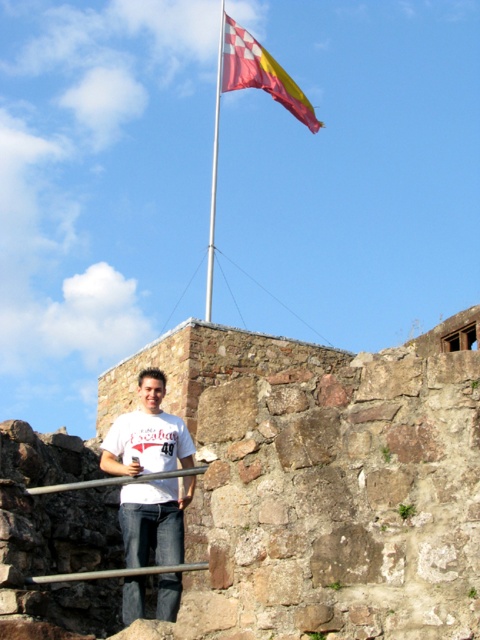
Question: Which object is closer to the camera taking this photo?

Choices:
 (A) white metallic flag pole at upper center
 (B) red and white checkered flag at upper center
 (C) white matte t-shirt at center
 (D) silver metallic rail at lower center

Answer: (D)

Question: From the image, what is the correct spatial relationship of white matte t-shirt at center in relation to white metallic flag pole at upper center?

Choices:
 (A) below
 (B) above

Answer: (A)

Question: Which point is closer to the camera taking this photo?

Choices:
 (A) (228, 61)
 (B) (186, 444)
 (C) (95, 572)

Answer: (C)

Question: Which of the following is the farthest from the observer?

Choices:
 (A) (210, 241)
 (B) (283, 88)
 (C) (132, 552)

Answer: (A)

Question: Does red and white checkered flag at upper center have a smaller size compared to white metallic flag pole at upper center?

Choices:
 (A) yes
 (B) no

Answer: (B)

Question: Does white matte t-shirt at center have a greater width compared to brushed metal rail at lower center?

Choices:
 (A) no
 (B) yes

Answer: (B)